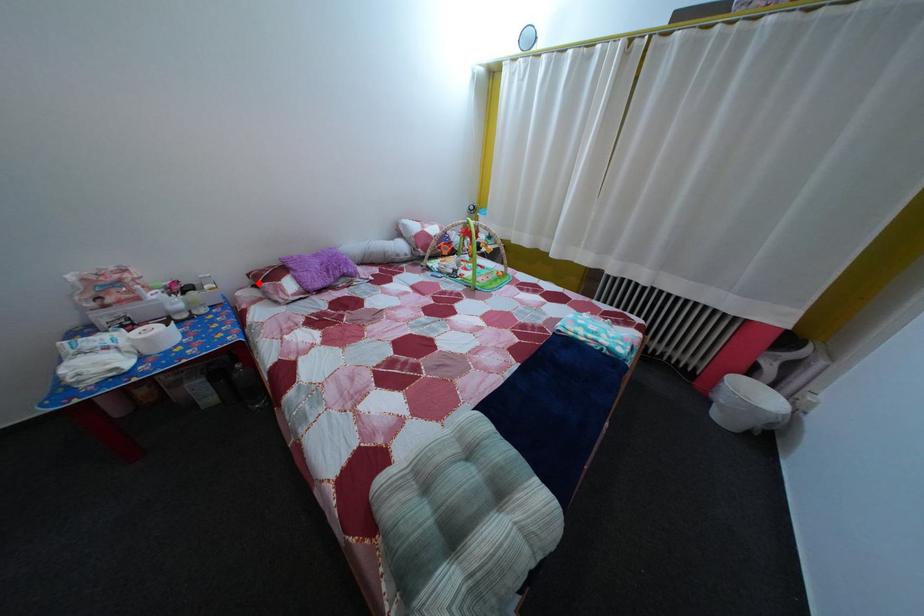
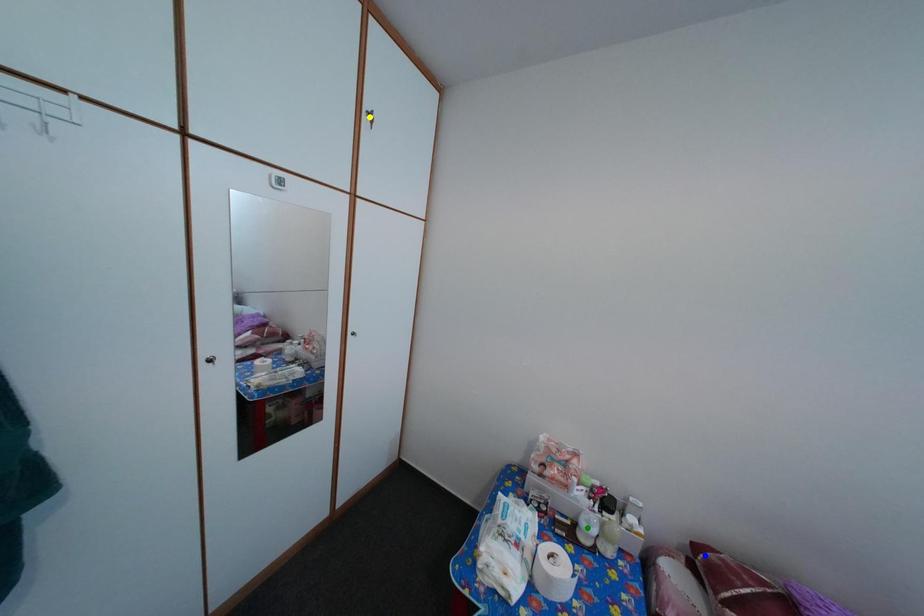
Question: I am providing you with two images of the same scene from different viewpoints. A red point is marked on the first image. You are given multiple points on the second image. Which point in image 2 represents the same 3d spot as the red point in image 1?

Choices:
 (A) yellow point
 (B) green point
 (C) blue point

Answer: (C)